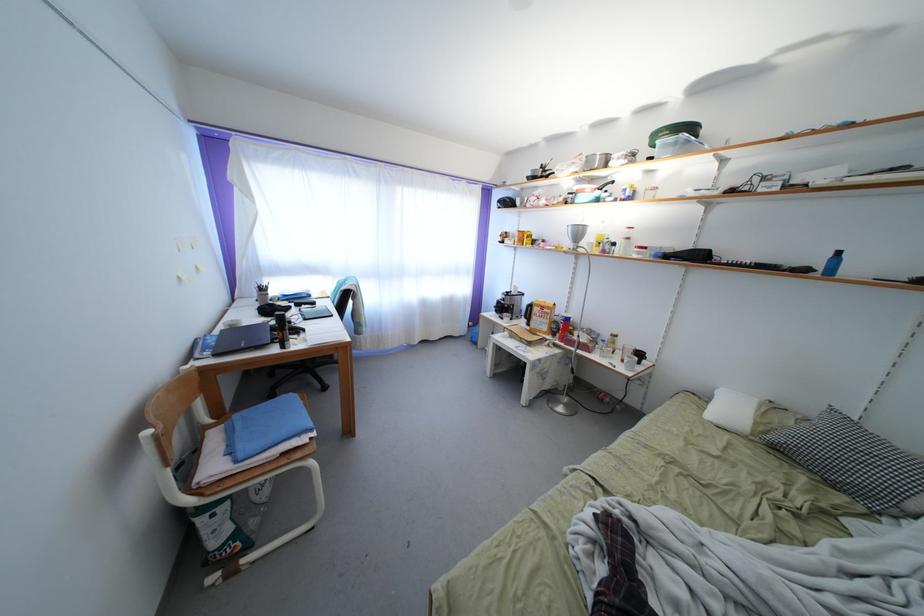
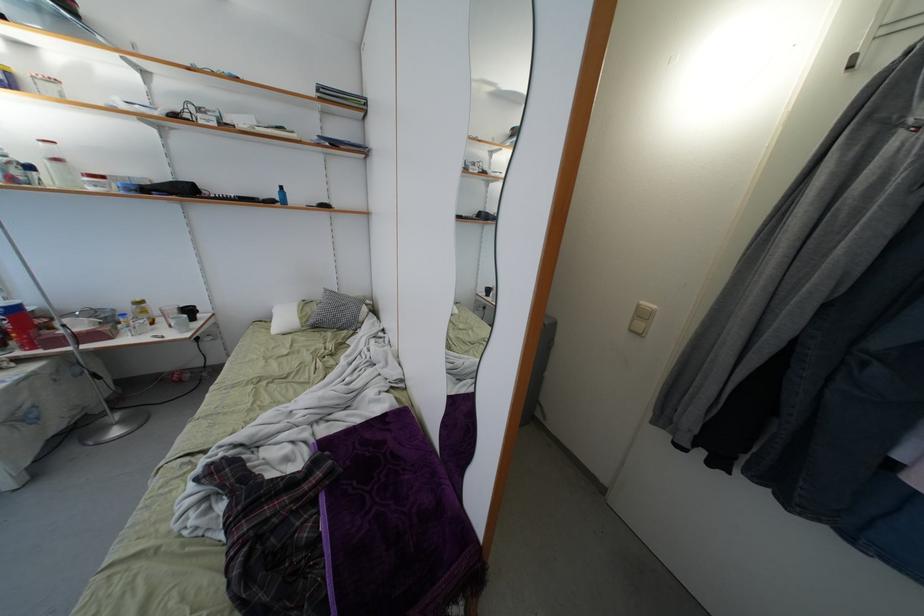
In the second image, find the point that corresponds to (x=763, y=430) in the first image.

(306, 323)